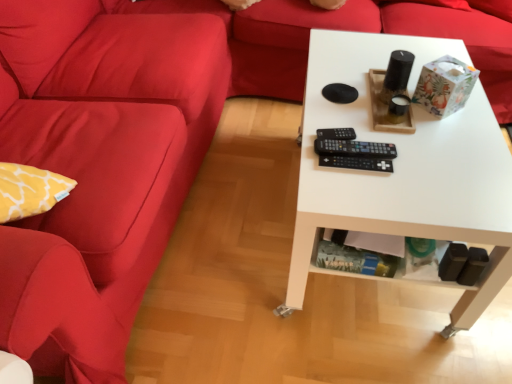
At what (x,y) coordinates should I click in order to perform the action: click on vacant area that lies to the right of black plastic remote at center, arranged as the second control when viewed from the top. Please return your answer as a coordinate pair (x, y). Image resolution: width=512 pixels, height=384 pixels. Looking at the image, I should click on (420, 148).